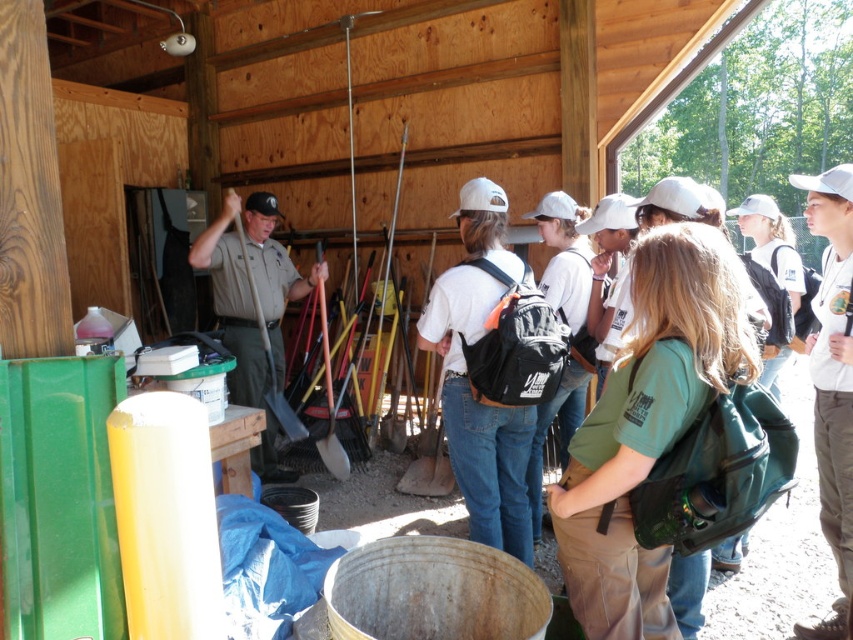
You are part of the group in the wooden shed workshop. You need to determine which object is larger between the khaki uniform at center and the brushed metal shovel at center. Which one is bigger?

The khaki uniform at center is bigger than the brushed metal shovel at center.

Consider the image. You are a person standing at the back of the group in the wooden shed. You want to hand your green fabric backpack at center to the person holding the brushed metal shovel at center. Can you directly hand it to them without moving the backpack?

The green fabric backpack at center is in front of the brushed metal shovel at center, so you can directly hand it to them without moving the backpack.